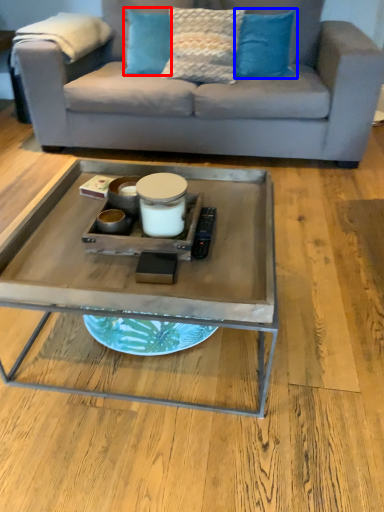
Question: Which object is further to the camera taking this photo, pillow (highlighted by a red box) or pillow (highlighted by a blue box)?

Choices:
 (A) pillow
 (B) pillow

Answer: (A)